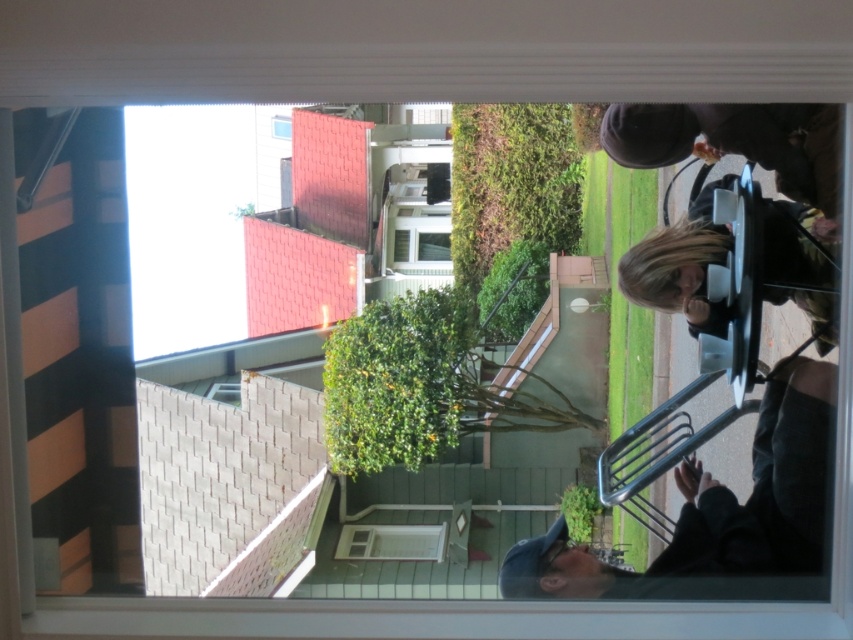
You are standing inside a building looking out the window. You notice a point marked at coordinates (718, 508) on the window. What object does this point correspond to?

The point at (718, 508) corresponds to the dark gray fabric jacket at lower right.

You are standing inside the building looking out the window. You notice two objects in your view. One is the blonde hair at lower right and the other is the matte glass window at upper center. Which object is closer to the right edge of your field of view?

The blonde hair at lower right is positioned on the right side of the matte glass window at upper center, so the blonde hair at lower right is closer to the right edge of the field of view.